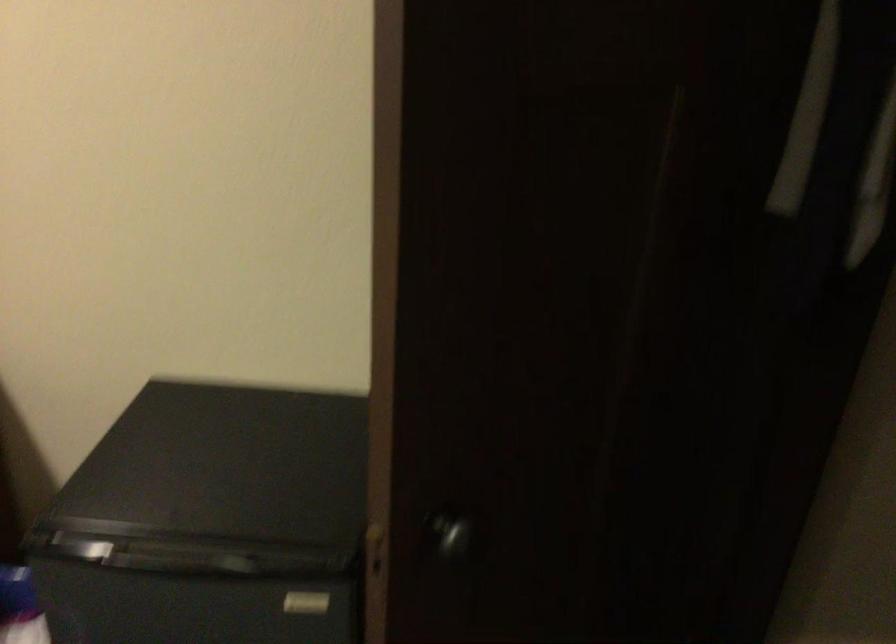
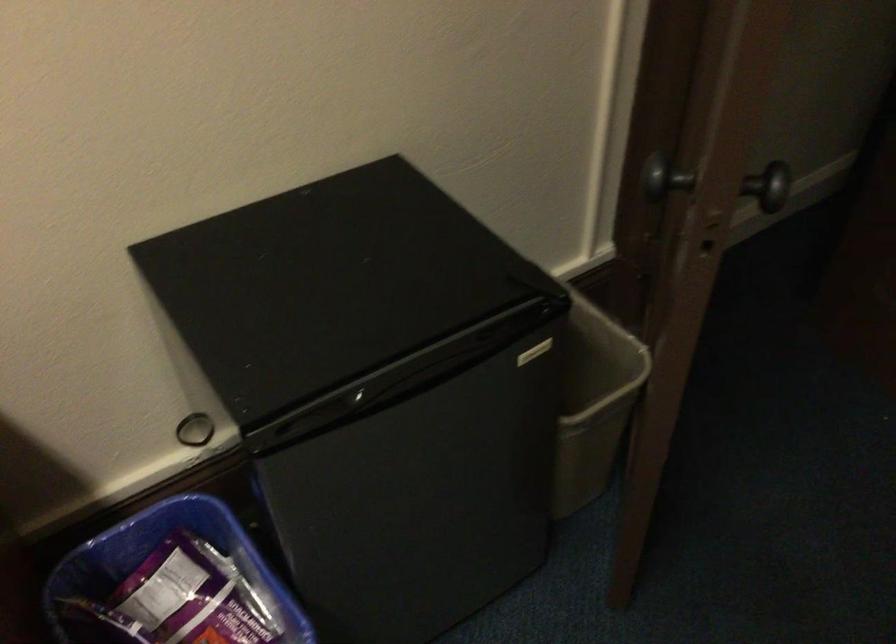
Locate, in the second image, the point that corresponds to pixel 135 550 in the first image.

(365, 399)